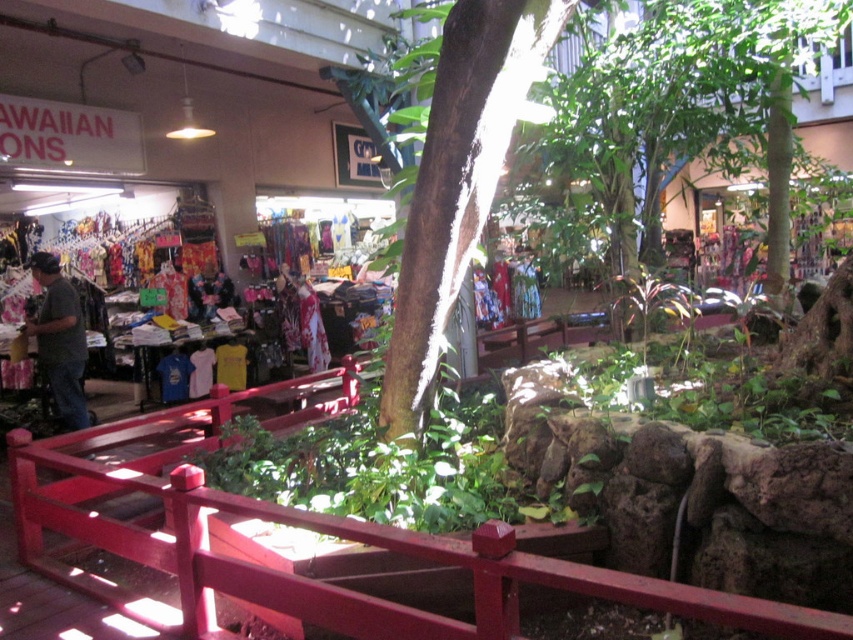
Question: In this image, where is smooth wood bridge at center located relative to dark gray t-shirt at left?

Choices:
 (A) below
 (B) above

Answer: (A)

Question: Does smooth wood bridge at center appear on the left side of dark gray t-shirt at left?

Choices:
 (A) yes
 (B) no

Answer: (B)

Question: Which of the following is the closest to the observer?

Choices:
 (A) (845, 634)
 (B) (61, 275)

Answer: (A)

Question: Which point is farther from the camera taking this photo?

Choices:
 (A) (70, 509)
 (B) (51, 268)

Answer: (B)

Question: Is smooth wood bridge at center further to camera compared to dark gray t-shirt at left?

Choices:
 (A) yes
 (B) no

Answer: (B)

Question: Which point is farther to the camera?

Choices:
 (A) (190, 579)
 (B) (51, 292)

Answer: (B)